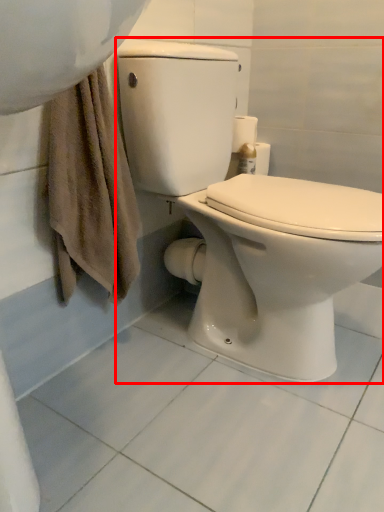
Question: In this image, where is toilet (annotated by the red box) located relative to toilet paper?

Choices:
 (A) right
 (B) left

Answer: (B)